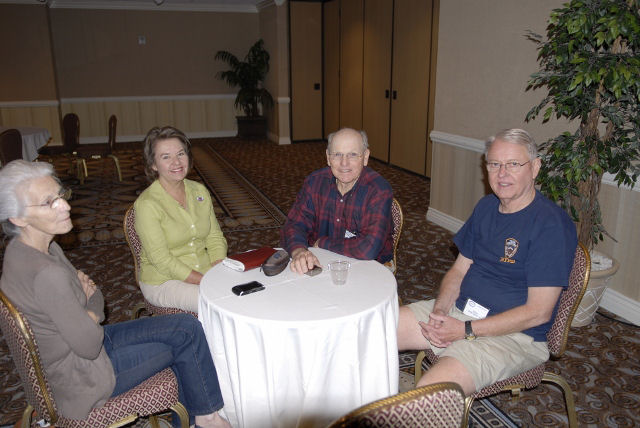
Where is `one round table`? The image size is (640, 428). one round table is located at coordinates (310, 310).